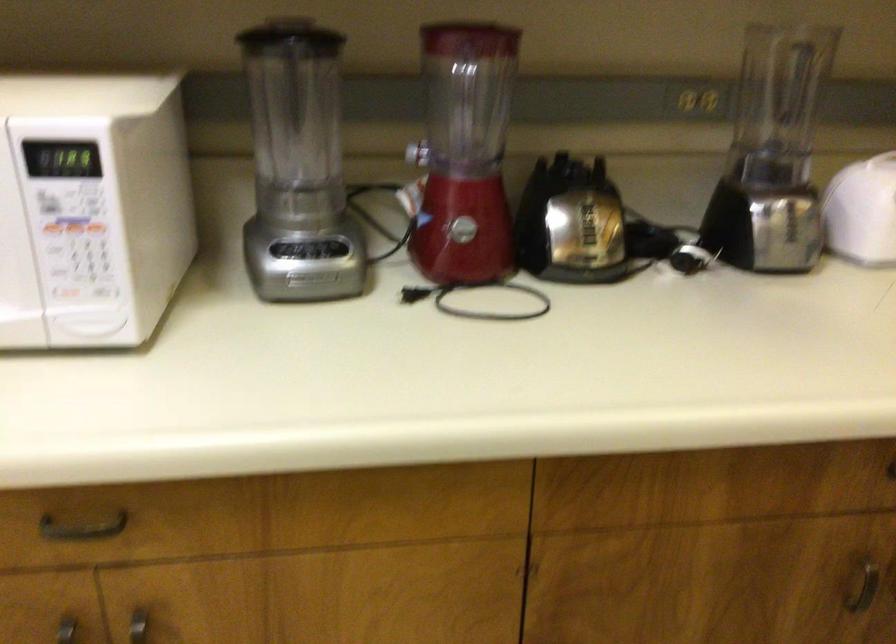
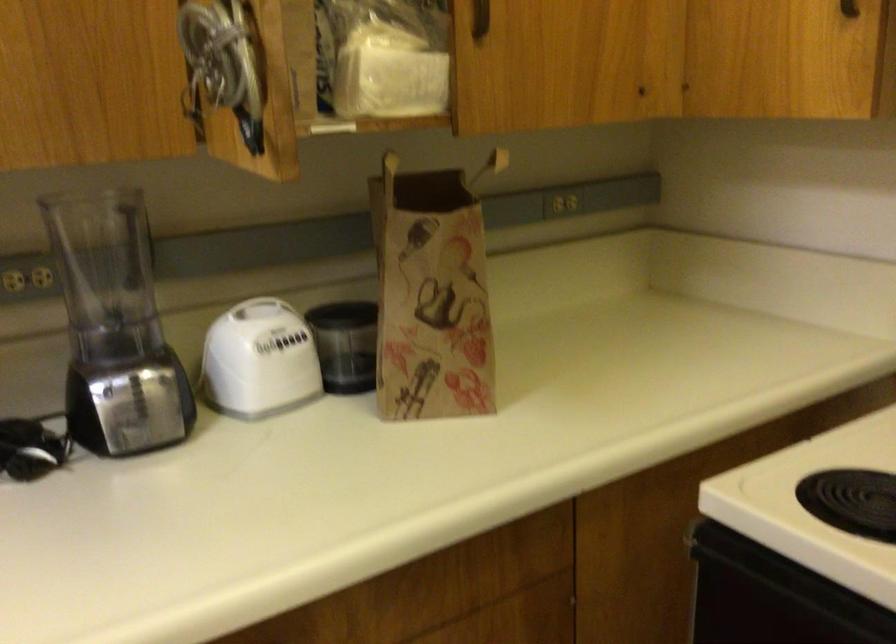
Where in the second image is the point corresponding to the point at 777,147 from the first image?

(115, 327)